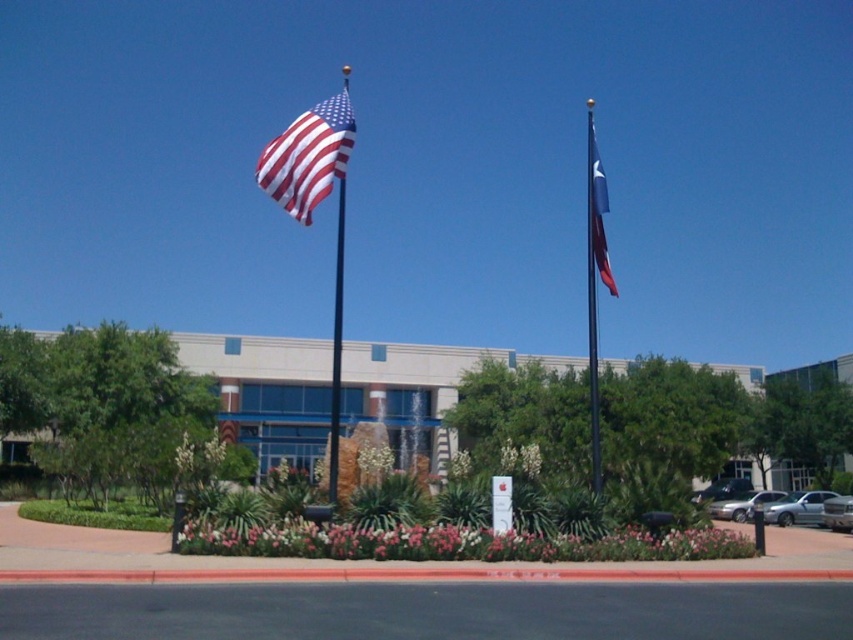
You are standing at the entrance of the building and want to walk towards the water fountain in the garden. There are two points marked on the path. The first point is at coordinates point (791, 493) and the second point is at point (746, 516). Which point should you step on first to reach the fountain?

You should step on point (791, 493) first because it is in front of point (746, 516), so stepping on the first point will lead you closer to the fountain.